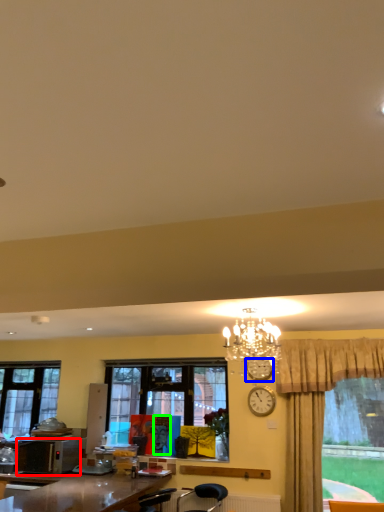
Question: Which object is the farthest from microwave oven (highlighted by a red box)? Choose among these: clock (highlighted by a blue box) or person (highlighted by a green box).

Choices:
 (A) clock
 (B) person

Answer: (A)